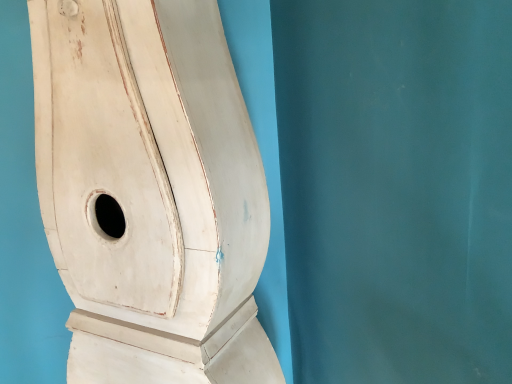
At what (x,y) coordinates should I click in order to perform the action: click on white matte wood toilet at upper left. Please return your answer as a coordinate pair (x, y). This screenshot has width=512, height=384. Looking at the image, I should click on (151, 191).

Describe the element at coordinates (151, 191) in the screenshot. I see `white matte wood toilet at upper left` at that location.

Where is `white matte wood toilet at upper left`? Image resolution: width=512 pixels, height=384 pixels. white matte wood toilet at upper left is located at coordinates (151, 191).